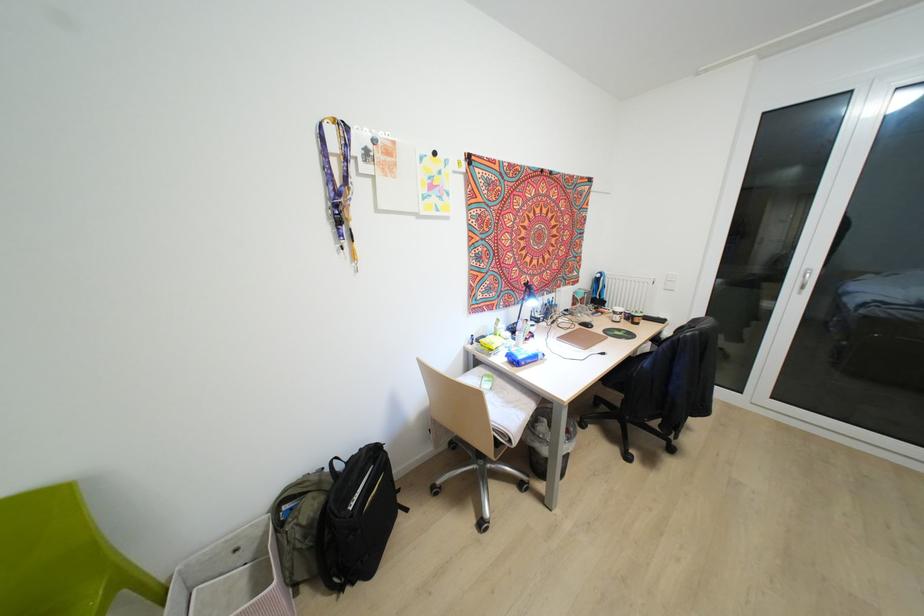
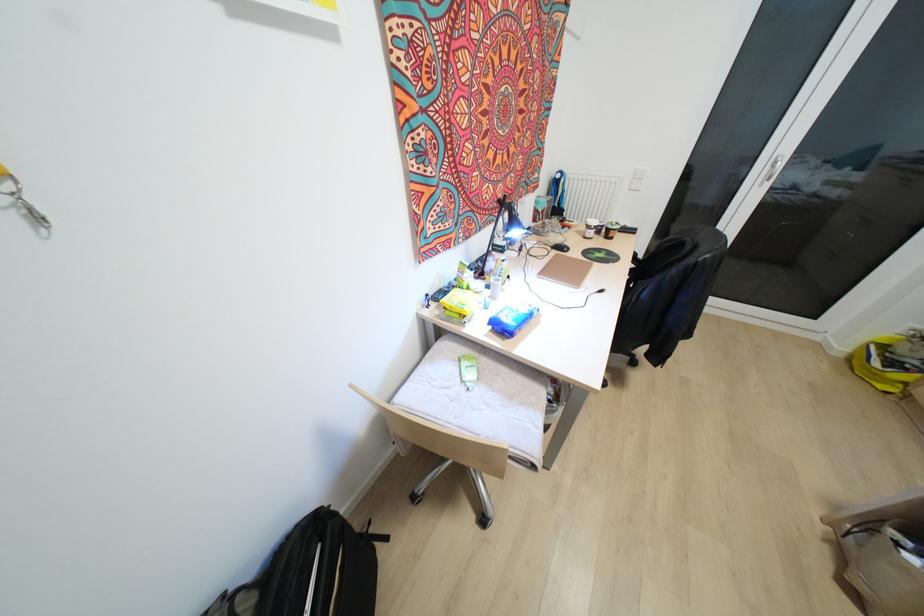
Find the pixel in the second image that matches point 513,408 in the first image.

(519, 408)